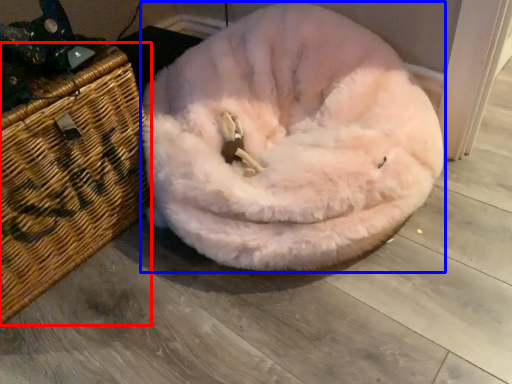
Question: Which object appears farthest to the camera in this image, basket (highlighted by a red box) or dog bed (highlighted by a blue box)?

Choices:
 (A) basket
 (B) dog bed

Answer: (A)